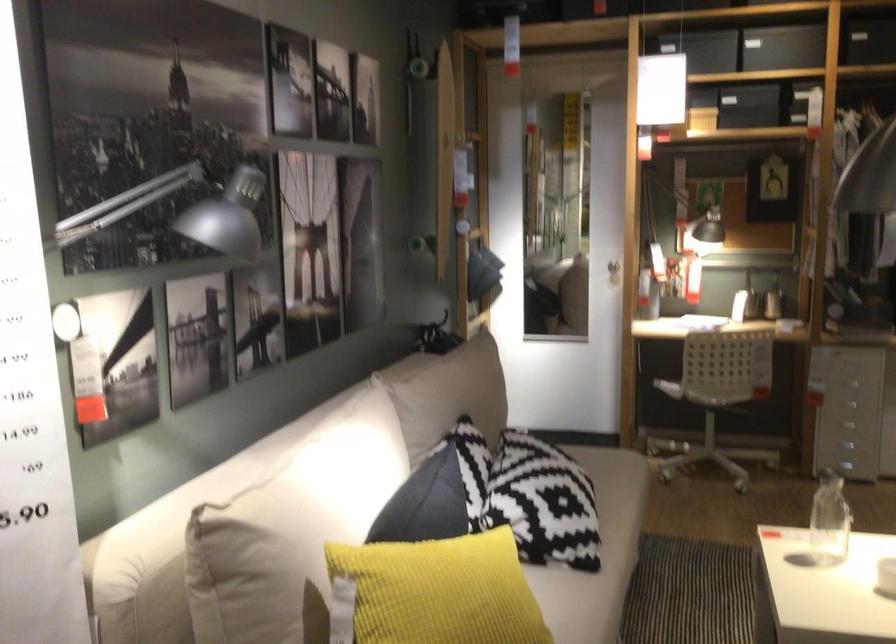
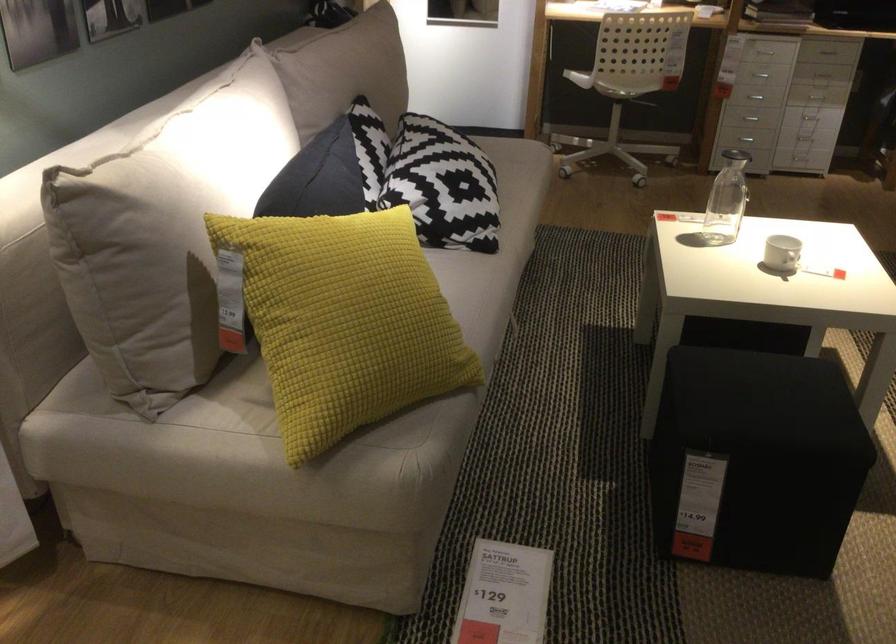
Locate, in the second image, the point that corresponds to pixel 545 505 in the first image.

(442, 185)